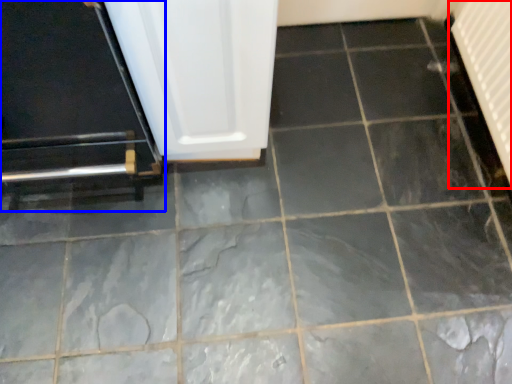
Question: Which point is closer to the camera, radiator (highlighted by a red box) or door (highlighted by a blue box)?

Choices:
 (A) radiator
 (B) door

Answer: (B)